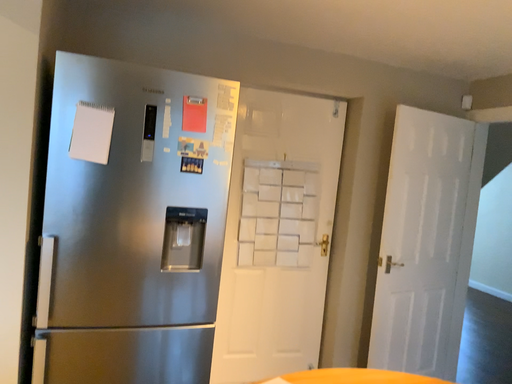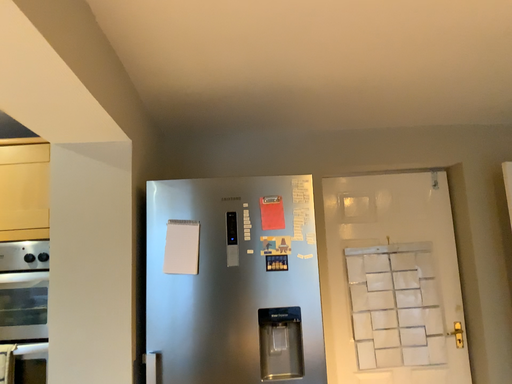
Question: Which way did the camera rotate in the video?

Choices:
 (A) rotated right
 (B) rotated left

Answer: (B)